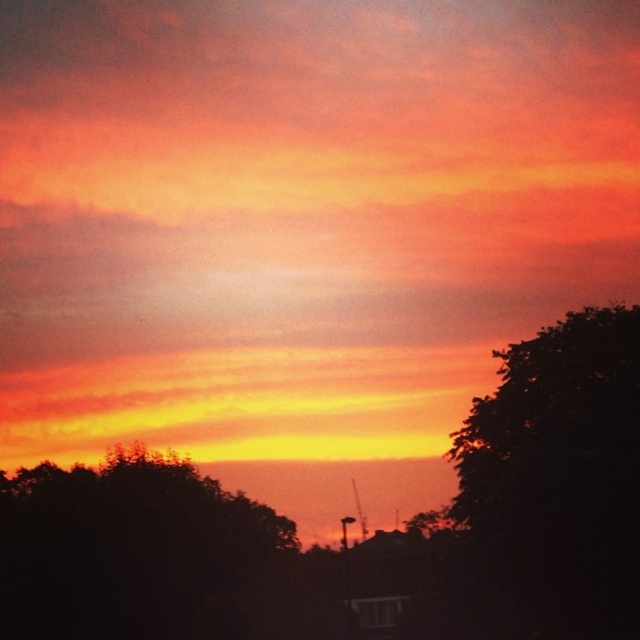
You are standing in the field looking at the sunset. You see the dark green leafy tree at right and the silhouette tree at lower left. Which tree is closer to the horizon?

The silhouette tree at lower left is closer to the horizon because the dark green leafy tree at right is positioned over it, indicating it is in front and blocking part of the view to the horizon.

You are standing in the field and see the dark green leafy tree at right and the silhouette tree at lower left. Which tree is closer to you?

The dark green leafy tree at right is closer to the viewer than the silhouette tree at lower left.